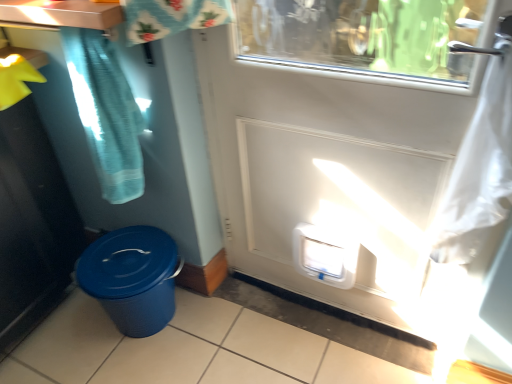
Question: Is white plastic water cooler at lower center positioned before brushed metal counter top at upper left?

Choices:
 (A) yes
 (B) no

Answer: (B)

Question: From the image's perspective, is white plastic water cooler at lower center located beneath brushed metal counter top at upper left?

Choices:
 (A) no
 (B) yes

Answer: (B)

Question: Is white plastic water cooler at lower center turned away from brushed metal counter top at upper left?

Choices:
 (A) yes
 (B) no

Answer: (B)

Question: Considering the relative sizes of white plastic water cooler at lower center and brushed metal counter top at upper left in the image provided, is white plastic water cooler at lower center shorter than brushed metal counter top at upper left?

Choices:
 (A) no
 (B) yes

Answer: (A)

Question: Considering the relative sizes of white plastic water cooler at lower center and brushed metal counter top at upper left in the image provided, is white plastic water cooler at lower center thinner than brushed metal counter top at upper left?

Choices:
 (A) yes
 (B) no

Answer: (A)

Question: From the image's perspective, is white plastic water cooler at lower center on brushed metal counter top at upper left?

Choices:
 (A) yes
 (B) no

Answer: (B)

Question: From the image's perspective, would you say teal fabric shower curtain at upper left is shown under blue textured plastic bin at lower left?

Choices:
 (A) yes
 (B) no

Answer: (B)

Question: From a real-world perspective, is teal fabric shower curtain at upper left under blue textured plastic bin at lower left?

Choices:
 (A) yes
 (B) no

Answer: (B)

Question: Is teal fabric shower curtain at upper left at the left side of blue textured plastic bin at lower left?

Choices:
 (A) no
 (B) yes

Answer: (A)

Question: Can you confirm if teal fabric shower curtain at upper left is thinner than blue textured plastic bin at lower left?

Choices:
 (A) no
 (B) yes

Answer: (B)

Question: From a real-world perspective, is teal fabric shower curtain at upper left located higher than blue textured plastic bin at lower left?

Choices:
 (A) yes
 (B) no

Answer: (A)

Question: Is teal fabric shower curtain at upper left further to the viewer compared to blue textured plastic bin at lower left?

Choices:
 (A) no
 (B) yes

Answer: (A)

Question: Does blue textured plastic bin at lower left have a greater width compared to white plastic water cooler at lower center?

Choices:
 (A) no
 (B) yes

Answer: (B)